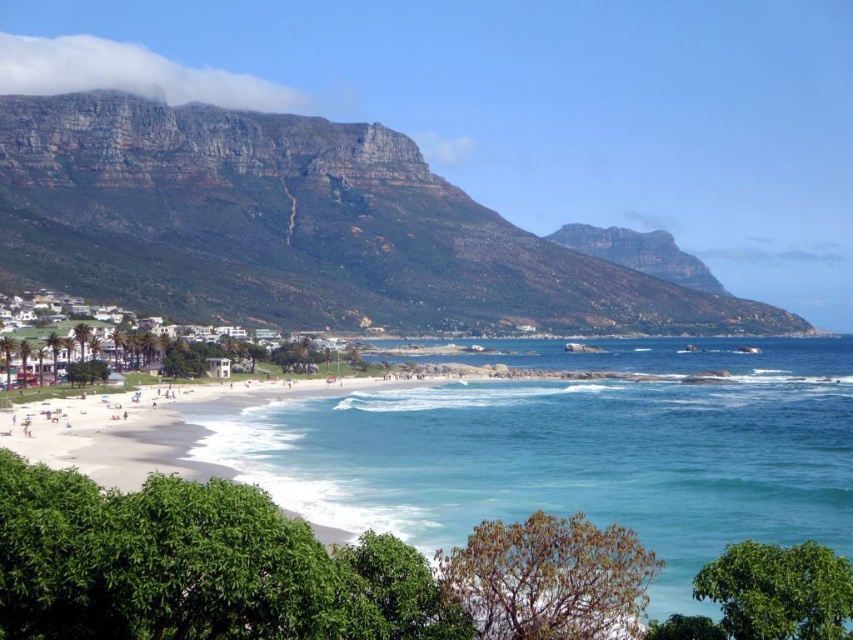
Does rugged rock mountain at upper center have a smaller size compared to clear blue water at center?

No, rugged rock mountain at upper center is not smaller than clear blue water at center.

Can you confirm if rugged rock mountain at upper center is positioned below clear blue water at center?

No.

What do you see at coordinates (297, 227) in the screenshot?
I see `rugged rock mountain at upper center` at bounding box center [297, 227].

Find the location of a particular element. rugged rock mountain at upper center is located at coordinates (x=297, y=227).